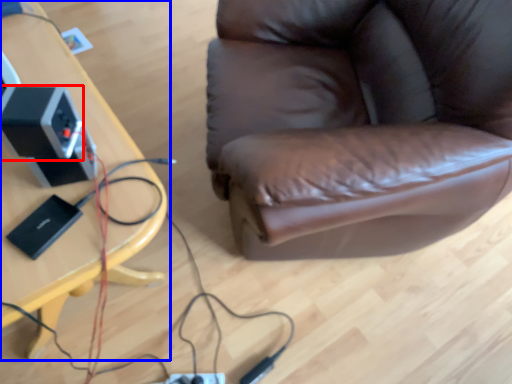
Question: Which of the following is the farthest to the observer, speaker (highlighted by a red box) or table (highlighted by a blue box)?

Choices:
 (A) speaker
 (B) table

Answer: (A)